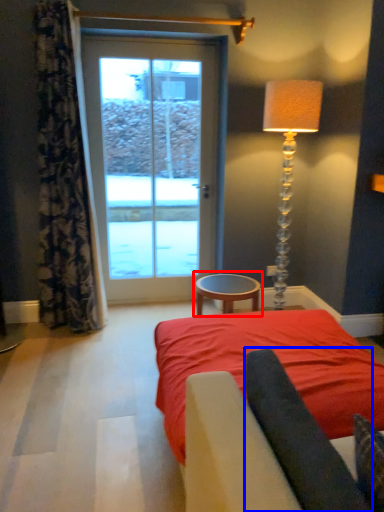
Question: Which of the following is the farthest to the observer, table (highlighted by a red box) or dark (highlighted by a blue box)?

Choices:
 (A) table
 (B) dark

Answer: (A)